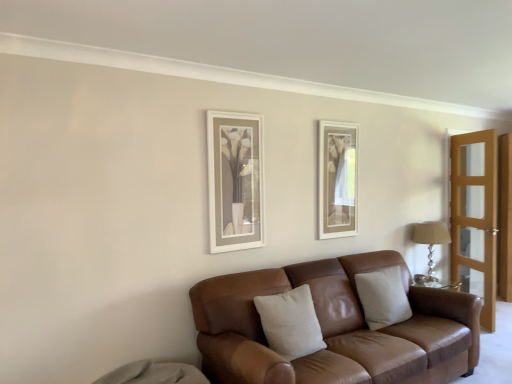
Question: From a real-world perspective, is beige leather pillow at center, marked as the second pillow in a front-to-back arrangement, positioned above or below silver glass table lamp at right?

Choices:
 (A) above
 (B) below

Answer: (B)

Question: Visually, is beige leather pillow at center, which ranks as the 1th pillow in right-to-left order, positioned to the left or to the right of silver glass table lamp at right?

Choices:
 (A) left
 (B) right

Answer: (A)

Question: Considering the real-world distances, which object is farthest from the beige cotton pillow at center, which is the second pillow from right to left?

Choices:
 (A) silver glass table lamp at right
 (B) light brown wooden screen door at right
 (C) beige leather pillow at center, which ranks as the first pillow in back-to-front order
 (D) brown leather couch at center

Answer: (B)

Question: Estimate the real-world distances between objects in this image. Which object is closer to the light brown wooden screen door at right?

Choices:
 (A) beige leather pillow at center, which ranks as the first pillow in back-to-front order
 (B) brown leather couch at center
 (C) silver glass table lamp at right
 (D) beige cotton pillow at center, which is the 1th pillow in front-to-back order

Answer: (C)